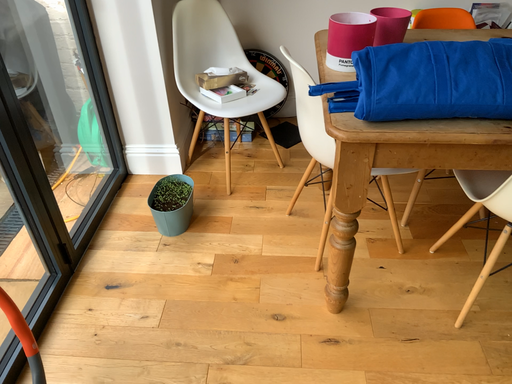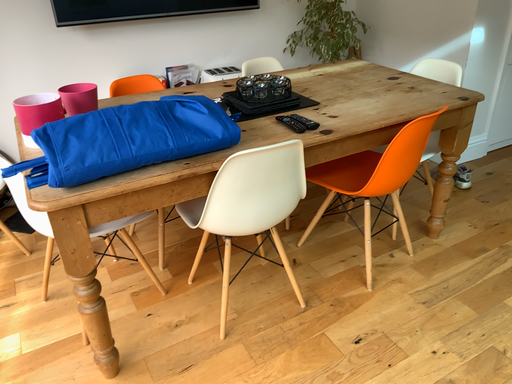
Question: How did the camera likely rotate when shooting the video?

Choices:
 (A) rotated right
 (B) rotated left

Answer: (A)